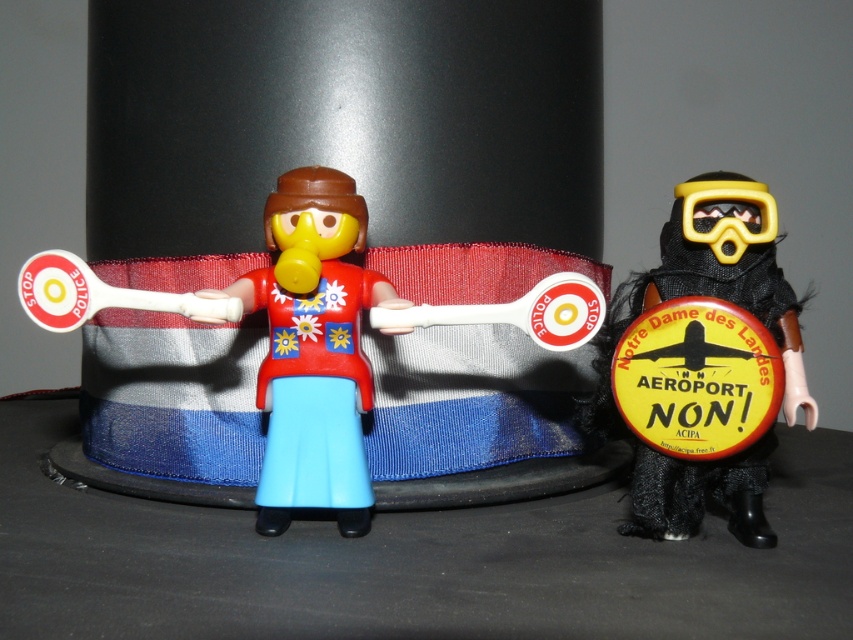
Is matte plastic toy at center behind matte plastic figure at center?

Yes, matte plastic toy at center is further from the viewer.

Which is above, matte plastic toy at center or matte plastic figure at center?

matte plastic toy at center is above.

I want to click on matte plastic toy at center, so click(x=335, y=333).

Does matte plastic toy at center appear on the left side of black fabric mask at right?

Yes, matte plastic toy at center is to the left of black fabric mask at right.

Does point (263, 476) lie behind point (698, 244)?

No, (263, 476) is in front of (698, 244).

Identify the location of matte plastic toy at center. Image resolution: width=853 pixels, height=640 pixels. (335, 333).

Locate an element on the screen. The image size is (853, 640). matte plastic toy at center is located at coordinates (335, 333).

Can you confirm if matte plastic figure at center is bigger than black fabric mask at right?

No, matte plastic figure at center is not bigger than black fabric mask at right.

Can you confirm if matte plastic figure at center is positioned below black fabric mask at right?

No.

Which is in front, point (271, 449) or point (784, 408)?

Point (271, 449) is more forward.

Locate an element on the screen. matte plastic figure at center is located at coordinates (312, 349).